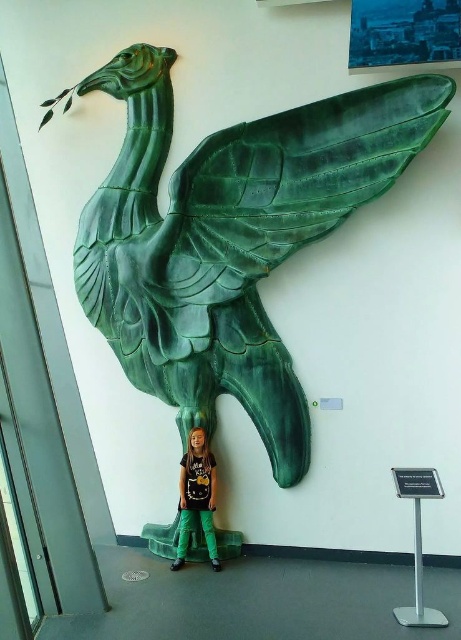
You are holding a camera and want to take a photo of the green glossy bird at upper center. If you are standing 3.37 meters away from the bird sculpture, will you be able to capture the entire sculpture in your photo without moving closer or farther?

The green glossy bird at upper center and camera are 3.37 meters apart from each other. Assuming the camera has a standard lens with a typical field of view, you should be able to capture the entire sculpture without moving closer or farther, as the distance is sufficient to include the entire bird sculpture in the frame.